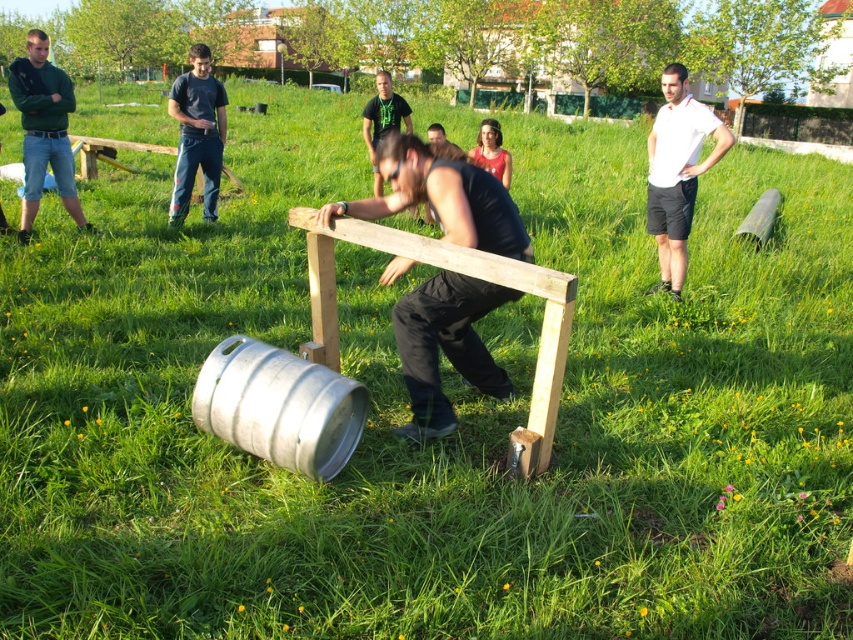
You are standing at the point marked by the coordinates point (677,172) in the image. Looking around, you see a man pushing a wooden frame and a metallic keg on the grass. Which object is closer to your current position?

The white cotton shirt at upper right is at point (677,172), so you are standing at that location. The man pushing the wooden frame and the metallic keg are further away from your position.

You are a photographer setting up a shoot in this outdoor scene. You need to place a new prop between the metallic silver squat at center and the white cotton shirt at upper right. Based on their positions, where should you place the prop to ensure it is between them?

The metallic silver squat at center is positioned under the white cotton shirt at upper right, so placing the prop between them would require positioning it above the metallic silver squat at center and below the white cotton shirt at upper right.

You are a photographer standing at the camera position. You want to take a closeup photo of the metallic silver squat at center. Can you move closer to it without stepping on the grass? The closest you can get is 3 meters from the camera position.

The metallic silver squat at center is 3.46 meters from the camera. Since the closest you can get is 3 meters from the camera position, you can move closer to it without stepping on the grass because 3 meters is less than 3.46 meters.